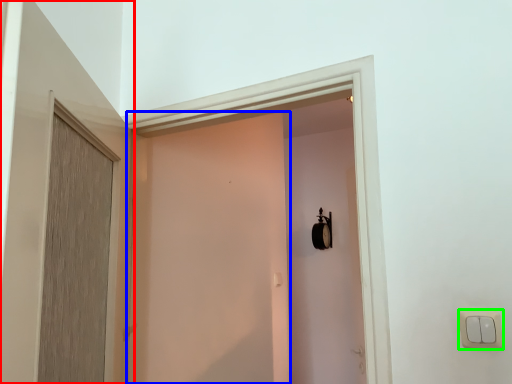
Question: Considering the real-world distances, which object is farthest from door (highlighted by a red box)? screen door (highlighted by a blue box) or light switch (highlighted by a green box)?

Choices:
 (A) screen door
 (B) light switch

Answer: (B)